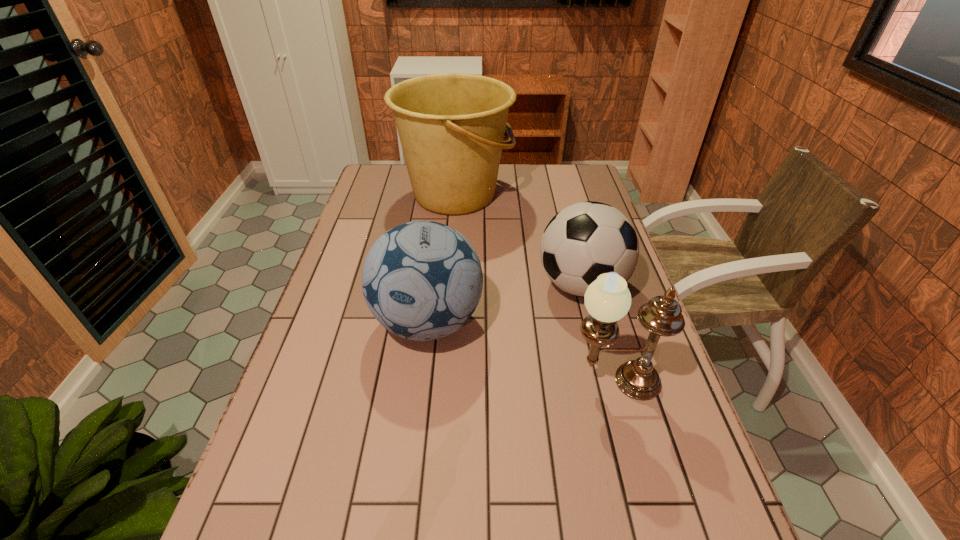
Find the location of a particular element. The height and width of the screenshot is (540, 960). vacant space in between the right soccer ball and the left soccer ball is located at coordinates (505, 304).

I want to click on free space between the right soccer ball and the left soccer ball, so click(x=505, y=304).

At what (x,y) coordinates should I click in order to perform the action: click on free space between the oil lamp and the farthest object. Please return your answer as a coordinate pair (x, y). The width and height of the screenshot is (960, 540). Looking at the image, I should click on (535, 288).

At what (x,y) coordinates should I click in order to perform the action: click on free space between the right soccer ball and the farthest object. Please return your answer as a coordinate pair (x, y). Looking at the image, I should click on (518, 240).

The width and height of the screenshot is (960, 540). Find the location of `free spot between the left soccer ball and the right soccer ball`. free spot between the left soccer ball and the right soccer ball is located at coordinates (505, 304).

Identify which object is the second closest to the left soccer ball. Please provide its 2D coordinates. Your answer should be formatted as a tuple, i.e. [(x, y)], where the tuple contains the x and y coordinates of a point satisfying the conditions above.

[(607, 299)]

The width and height of the screenshot is (960, 540). I want to click on object that is the second nearest to the bucket, so click(422, 280).

Locate an element on the screen. vacant region that satisfies the following two spatial constraints: 1. on the side of the oil lamp with the handle; 2. on the right side of the bucket is located at coordinates (440, 382).

Find the location of a particular element. The height and width of the screenshot is (540, 960). free location that satisfies the following two spatial constraints: 1. on the side with brand of the oil lamp; 2. on the right side of the left soccer ball is located at coordinates pos(420,382).

The width and height of the screenshot is (960, 540). I want to click on vacant space that satisfies the following two spatial constraints: 1. on the side of the oil lamp with the handle; 2. on the left side of the bucket, so click(440, 382).